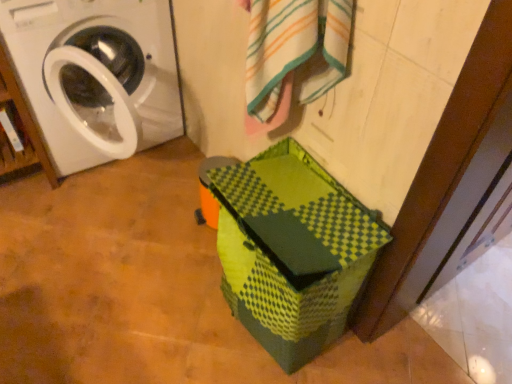
Question: Does white striped bath towel at upper center have a greater height compared to white glossy washing machine at left?

Choices:
 (A) yes
 (B) no

Answer: (B)

Question: From a real-world perspective, is white striped bath towel at upper center below white glossy washing machine at left?

Choices:
 (A) no
 (B) yes

Answer: (A)

Question: Considering the relative sizes of white striped bath towel at upper center and white glossy washing machine at left in the image provided, is white striped bath towel at upper center bigger than white glossy washing machine at left?

Choices:
 (A) no
 (B) yes

Answer: (A)

Question: Is white striped bath towel at upper center at the left side of white glossy washing machine at left?

Choices:
 (A) yes
 (B) no

Answer: (B)

Question: Is white striped bath towel at upper center oriented towards white glossy washing machine at left?

Choices:
 (A) yes
 (B) no

Answer: (B)

Question: Is white striped bath towel at upper center placed right next to white glossy washing machine at left?

Choices:
 (A) no
 (B) yes

Answer: (A)

Question: Does matte white washing machine at left come behind white striped bath towel at upper center?

Choices:
 (A) yes
 (B) no

Answer: (A)

Question: From the image's perspective, is matte white washing machine at left below white striped bath towel at upper center?

Choices:
 (A) yes
 (B) no

Answer: (B)

Question: Could you tell me if matte white washing machine at left is facing white striped bath towel at upper center?

Choices:
 (A) no
 (B) yes

Answer: (A)

Question: Is white striped bath towel at upper center located within matte white washing machine at left?

Choices:
 (A) no
 (B) yes

Answer: (A)

Question: Is matte white washing machine at left facing away from white striped bath towel at upper center?

Choices:
 (A) no
 (B) yes

Answer: (A)

Question: Are matte white washing machine at left and white striped bath towel at upper center located far from each other?

Choices:
 (A) no
 (B) yes

Answer: (B)

Question: Considering the relative sizes of white striped bath towel at upper center and green matte cardboard box at lower center in the image provided, is white striped bath towel at upper center taller than green matte cardboard box at lower center?

Choices:
 (A) no
 (B) yes

Answer: (A)